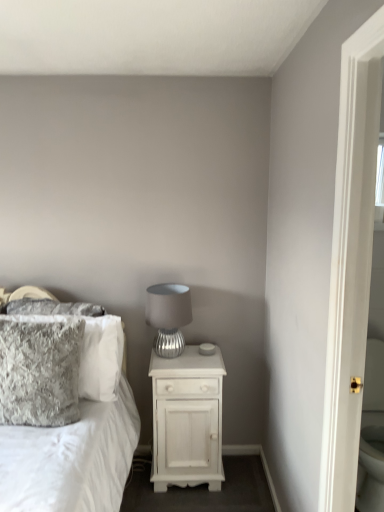
Find the location of a particular element. Image resolution: width=384 pixels, height=512 pixels. fuzzy gray pillow at left, the 2th pillow from the back is located at coordinates coord(40,372).

Consider the image. What is the approximate width of white fluffy pillow at left?

white fluffy pillow at left is 1.82 meters wide.

Describe the element at coordinates (100, 357) in the screenshot. Image resolution: width=384 pixels, height=512 pixels. I see `velvety gray pillow at left, the second pillow positioned from the front` at that location.

Image resolution: width=384 pixels, height=512 pixels. I want to click on fuzzy gray pillow at left, the 2th pillow from the back, so pyautogui.click(x=40, y=372).

Which is less distant, (218, 479) or (165, 302)?

The point (165, 302) is in front.

Looking at this image, considering the relative sizes of white wood nightstand at center and silver textured lamp at center in the image provided, is white wood nightstand at center taller than silver textured lamp at center?

Yes.

Can you confirm if white wood nightstand at center is wider than silver textured lamp at center?

Yes.

Considering the relative positions of white wood nightstand at center and silver textured lamp at center in the image provided, is white wood nightstand at center behind silver textured lamp at center?

No, white wood nightstand at center is closer to the camera.

Considering the sizes of fuzzy gray pillow at left, which is counted as the 1th pillow, starting from the front, and silver textured lamp at center in the image, is fuzzy gray pillow at left, which is counted as the 1th pillow, starting from the front, wider or thinner than silver textured lamp at center?

fuzzy gray pillow at left, which is counted as the 1th pillow, starting from the front, is thinner than silver textured lamp at center.

From a real-world perspective, is fuzzy gray pillow at left, which is counted as the 1th pillow, starting from the front, located higher than silver textured lamp at center?

No, from a real-world perspective, fuzzy gray pillow at left, which is counted as the 1th pillow, starting from the front, is not on top of silver textured lamp at center.

Based on the photo, considering the relative positions of fuzzy gray pillow at left, which is counted as the 1th pillow, starting from the front, and silver textured lamp at center in the image provided, is fuzzy gray pillow at left, which is counted as the 1th pillow, starting from the front, to the left or to the right of silver textured lamp at center?

fuzzy gray pillow at left, which is counted as the 1th pillow, starting from the front, is to the left of silver textured lamp at center.

How many degrees apart are the facing directions of velvety gray pillow at left, the first pillow in the back-to-front sequence, and fuzzy gray pillow at left, which is counted as the 1th pillow, starting from the front?

0.567 degrees separate the facing orientations of velvety gray pillow at left, the first pillow in the back-to-front sequence, and fuzzy gray pillow at left, which is counted as the 1th pillow, starting from the front.

From a real-world perspective, is velvety gray pillow at left, the second pillow positioned from the front, physically below fuzzy gray pillow at left, which is counted as the 1th pillow, starting from the front?

Correct, in the physical world, velvety gray pillow at left, the second pillow positioned from the front, is lower than fuzzy gray pillow at left, which is counted as the 1th pillow, starting from the front.

Is velvety gray pillow at left, the second pillow positioned from the front, located outside fuzzy gray pillow at left, which is counted as the 1th pillow, starting from the front?

That's correct, velvety gray pillow at left, the second pillow positioned from the front, is outside of fuzzy gray pillow at left, which is counted as the 1th pillow, starting from the front.

Would you consider velvety gray pillow at left, the first pillow in the back-to-front sequence, to be distant from fuzzy gray pillow at left, the 2th pillow from the back?

Answer: No, velvety gray pillow at left, the first pillow in the back-to-front sequence, is in close proximity to fuzzy gray pillow at left, the 2th pillow from the back.

Considering the positions of point (120, 436) and point (182, 287), is point (120, 436) closer or farther from the camera than point (182, 287)?

Point (120, 436).

Is white fluffy pillow at left with silver textured lamp at center?

No, white fluffy pillow at left is not next to silver textured lamp at center.

In the image, is white fluffy pillow at left positioned in front of or behind silver textured lamp at center?

Visually, white fluffy pillow at left is located in front of silver textured lamp at center.

Is white wood nightstand at center to the left or to the right of fuzzy gray pillow at left, the 2th pillow from the back, in the image?

From the image, it's evident that white wood nightstand at center is to the right of fuzzy gray pillow at left, the 2th pillow from the back.

Does white wood nightstand at center touch fuzzy gray pillow at left, the 2th pillow from the back?

They are not placed beside each other.

In terms of size, does white wood nightstand at center appear bigger or smaller than fuzzy gray pillow at left, which is counted as the 1th pillow, starting from the front?

Considering their sizes, white wood nightstand at center takes up more space than fuzzy gray pillow at left, which is counted as the 1th pillow, starting from the front.

Is fuzzy gray pillow at left, the 2th pillow from the back, bigger or smaller than white wood nightstand at center?

In the image, fuzzy gray pillow at left, the 2th pillow from the back, appears to be smaller than white wood nightstand at center.

From a real-world perspective, which object stands above the other?

In real-world perspective, fuzzy gray pillow at left, the 2th pillow from the back, is above.

The image size is (384, 512). Find the location of `nightstand behind the fuzzy gray pillow at left, the 2th pillow from the back`. nightstand behind the fuzzy gray pillow at left, the 2th pillow from the back is located at coordinates [187, 419].

How different are the orientations of velvety gray pillow at left, the first pillow in the back-to-front sequence, and silver textured lamp at center in degrees?

The facing directions of velvety gray pillow at left, the first pillow in the back-to-front sequence, and silver textured lamp at center are 0.632 degrees apart.

From the image's perspective, is velvety gray pillow at left, the first pillow in the back-to-front sequence, under silver textured lamp at center?

Yes, from the image's perspective, velvety gray pillow at left, the first pillow in the back-to-front sequence, is below silver textured lamp at center.

Is velvety gray pillow at left, the first pillow in the back-to-front sequence, to the right of silver textured lamp at center from the viewer's perspective?

No.

How distant is velvety gray pillow at left, the first pillow in the back-to-front sequence, from silver textured lamp at center?

velvety gray pillow at left, the first pillow in the back-to-front sequence, is 13.78 inches away from silver textured lamp at center.

You are a GUI agent. You are given a task and a screenshot of the screen. Output one action in this format:
    pyautogui.click(x=<x>, y=<y>)
    Task: Click on the nightstand below the silver textured lamp at center (from a real-world perspective)
    Image resolution: width=384 pixels, height=512 pixels.
    Given the screenshot: What is the action you would take?
    pyautogui.click(x=187, y=419)

From the image's perspective, starting from the silver textured lamp at center, which pillow is the 1st one below? Please provide its 2D coordinates.

[(40, 372)]

From the image, which object appears to be farther from velvety gray pillow at left, the first pillow in the back-to-front sequence, white wood nightstand at center or silver textured lamp at center?

The object further to velvety gray pillow at left, the first pillow in the back-to-front sequence, is white wood nightstand at center.

Looking at the image, which one is located closer to fuzzy gray pillow at left, the 2th pillow from the back, silver textured lamp at center or white fluffy pillow at left?

white fluffy pillow at left is closer to fuzzy gray pillow at left, the 2th pillow from the back.

Based on the photo, which object lies further to the anchor point fuzzy gray pillow at left, the 2th pillow from the back, white fluffy pillow at left or velvety gray pillow at left, the second pillow positioned from the front?

white fluffy pillow at left lies further to fuzzy gray pillow at left, the 2th pillow from the back, than the other object.

Which object lies further to the anchor point silver textured lamp at center, fuzzy gray pillow at left, the 2th pillow from the back, or white fluffy pillow at left?

Based on the image, fuzzy gray pillow at left, the 2th pillow from the back, appears to be further to silver textured lamp at center.

From the picture: From the image, which object appears to be farther from white wood nightstand at center, velvety gray pillow at left, the first pillow in the back-to-front sequence, or silver textured lamp at center?

Among the two, velvety gray pillow at left, the first pillow in the back-to-front sequence, is located further to white wood nightstand at center.

From the image, which object appears to be nearer to silver textured lamp at center, fuzzy gray pillow at left, which is counted as the 1th pillow, starting from the front, or velvety gray pillow at left, the first pillow in the back-to-front sequence?

velvety gray pillow at left, the first pillow in the back-to-front sequence, is positioned closer to the anchor silver textured lamp at center.

From the image, which object appears to be nearer to white fluffy pillow at left, white wood nightstand at center or velvety gray pillow at left, the first pillow in the back-to-front sequence?

Among the two, velvety gray pillow at left, the first pillow in the back-to-front sequence, is located nearer to white fluffy pillow at left.

Considering their positions, is white fluffy pillow at left positioned further to velvety gray pillow at left, the first pillow in the back-to-front sequence, than fuzzy gray pillow at left, the 2th pillow from the back?

white fluffy pillow at left lies further to velvety gray pillow at left, the first pillow in the back-to-front sequence, than the other object.

Locate an element on the screen. This screenshot has width=384, height=512. pillow between fuzzy gray pillow at left, which is counted as the 1th pillow, starting from the front, and white wood nightstand at center from left to right is located at coordinates (100, 357).

Where is `table lamp between velvety gray pillow at left, the second pillow positioned from the front, and white wood nightstand at center`? This screenshot has width=384, height=512. table lamp between velvety gray pillow at left, the second pillow positioned from the front, and white wood nightstand at center is located at coordinates (x=168, y=316).

Locate an element on the screen. This screenshot has height=512, width=384. nightstand located between white fluffy pillow at left and silver textured lamp at center in the depth direction is located at coordinates (187, 419).

You are a GUI agent. You are given a task and a screenshot of the screen. Output one action in this format:
    pyautogui.click(x=<x>, y=<y>)
    Task: Click on the pillow located between fuzzy gray pillow at left, the 2th pillow from the back, and silver textured lamp at center in the left-right direction
    Image resolution: width=384 pixels, height=512 pixels.
    Given the screenshot: What is the action you would take?
    pyautogui.click(x=100, y=357)